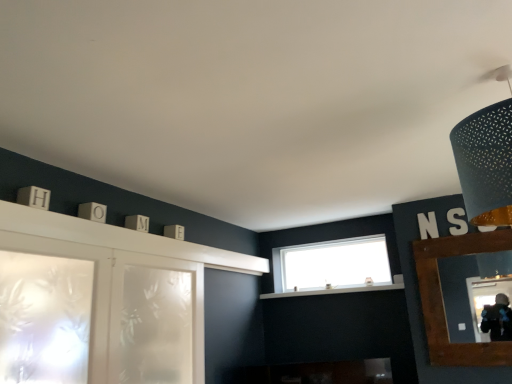
What is the approximate width of white glossy mantle at center?

white glossy mantle at center is 11.78 inches in width.

You are a GUI agent. You are given a task and a screenshot of the screen. Output one action in this format:
    pyautogui.click(x=<x>, y=<y>)
    Task: Click on the white glossy mantle at center
    This screenshot has height=384, width=512.
    Given the screenshot: What is the action you would take?
    pyautogui.click(x=333, y=291)

Image resolution: width=512 pixels, height=384 pixels. I want to click on frosted glass screen door at lower left, so click(156, 320).

Which is behind, point (157, 267) or point (422, 303)?

Positioned behind is point (422, 303).

Considering the sizes of objects frosted glass screen door at lower left and brown wooden mirror at right in the image provided, who is smaller, frosted glass screen door at lower left or brown wooden mirror at right?

With smaller size is brown wooden mirror at right.

How different are the orientations of frosted glass screen door at lower left and brown wooden mirror at right in degrees?

The angular difference between frosted glass screen door at lower left and brown wooden mirror at right is 90.5 degrees.

Is brown wooden mirror at right at the back of frosted glass screen door at lower left?

No, brown wooden mirror at right is not at the back of frosted glass screen door at lower left.

Can you confirm if frosted glass screen door at lower left is positioned to the right of white glossy mantle at center?

No.

Is frosted glass screen door at lower left looking in the opposite direction of white glossy mantle at center?

No, white glossy mantle at center is not at the back of frosted glass screen door at lower left.

Is point (196, 287) in front of point (305, 291)?

Yes, point (196, 287) is closer to viewer.

Would you say clear glass window at center is inside or outside white glossy mantle at center?

clear glass window at center is not inside white glossy mantle at center, it's outside.

Between clear glass window at center and white glossy mantle at center, which one appears on the left side from the viewer's perspective?

white glossy mantle at center.

Is clear glass window at center wider than white glossy mantle at center?

In fact, clear glass window at center might be narrower than white glossy mantle at center.

The width and height of the screenshot is (512, 384). I want to click on window above the white glossy mantle at center (from the image's perspective), so click(x=331, y=266).

What's the angular difference between brown wooden mirror at right and frosted glass screen door at lower left's facing directions?

90.5 degrees.

Is brown wooden mirror at right inside the boundaries of frosted glass screen door at lower left, or outside?

brown wooden mirror at right is outside frosted glass screen door at lower left.

Image resolution: width=512 pixels, height=384 pixels. I want to click on cabinetry behind the frosted glass screen door at lower left, so click(x=439, y=284).

Is brown wooden mirror at right bigger than frosted glass screen door at lower left?

Actually, brown wooden mirror at right might be smaller than frosted glass screen door at lower left.

From a real-world perspective, which object rests below the other?

frosted glass screen door at lower left, from a real-world perspective.

Can you confirm if matte black lampshade at upper right is positioned to the right of frosted glass screen door at lower left?

Indeed, matte black lampshade at upper right is positioned on the right side of frosted glass screen door at lower left.

Is matte black lampshade at upper right aimed at frosted glass screen door at lower left?

No.

Would you say frosted glass screen door at lower left is part of matte black lampshade at upper right's contents?

Actually, frosted glass screen door at lower left is outside matte black lampshade at upper right.

Which is farther from the camera, (x=289, y=266) or (x=450, y=344)?

Positioned behind is point (x=289, y=266).

Based on their sizes in the image, would you say clear glass window at center is bigger or smaller than brown wooden mirror at right?

clear glass window at center is bigger than brown wooden mirror at right.

Measure the distance from clear glass window at center to brown wooden mirror at right.

A distance of 30.18 inches exists between clear glass window at center and brown wooden mirror at right.

Is clear glass window at center oriented away from brown wooden mirror at right?

No, brown wooden mirror at right is not at the back of clear glass window at center.

Does white glossy mantle at center have a smaller size compared to brown wooden mirror at right?

No, white glossy mantle at center is not smaller than brown wooden mirror at right.

From the image's perspective, is white glossy mantle at center beneath brown wooden mirror at right?

Correct, white glossy mantle at center appears lower than brown wooden mirror at right in the image.

How many degrees apart are the facing directions of white glossy mantle at center and brown wooden mirror at right?

They differ by 0.136 degrees in their facing directions.

Is white glossy mantle at center to the right of brown wooden mirror at right from the viewer's perspective?

In fact, white glossy mantle at center is to the left of brown wooden mirror at right.

Locate an element on the screen. The width and height of the screenshot is (512, 384). cabinetry above the frosted glass screen door at lower left (from a real-world perspective) is located at coordinates (439, 284).

Find the location of a particular element. Image resolution: width=512 pixels, height=384 pixels. screen door that appears in front of the white glossy mantle at center is located at coordinates (156, 320).

Based on their spatial positions, is white glossy mantle at center or matte black lampshade at upper right closer to frosted glass screen door at lower left?

The object closer to frosted glass screen door at lower left is white glossy mantle at center.

From the image, which object appears to be farther from matte black lampshade at upper right, clear glass window at center or white glossy mantle at center?

Based on the image, clear glass window at center appears to be further to matte black lampshade at upper right.

Considering their positions, is white glossy mantle at center positioned further to frosted glass screen door at lower left than brown wooden mirror at right?

brown wooden mirror at right is further to frosted glass screen door at lower left.

From the image, which object appears to be nearer to white glossy mantle at center, matte black lampshade at upper right or clear glass window at center?

clear glass window at center is closer to white glossy mantle at center.

From the image, which object appears to be nearer to frosted glass screen door at lower left, brown wooden mirror at right or matte black lampshade at upper right?

Among the two, brown wooden mirror at right is located nearer to frosted glass screen door at lower left.

Estimate the real-world distances between objects in this image. Which object is further from clear glass window at center, white glossy mantle at center or matte black lampshade at upper right?

matte black lampshade at upper right lies further to clear glass window at center than the other object.

When comparing their distances from white glossy mantle at center, does frosted glass screen door at lower left or matte black lampshade at upper right seem closer?

Based on the image, frosted glass screen door at lower left appears to be nearer to white glossy mantle at center.

Considering their positions, is clear glass window at center positioned closer to white glossy mantle at center than frosted glass screen door at lower left?

Among the two, clear glass window at center is located nearer to white glossy mantle at center.

I want to click on screen door between matte black lampshade at upper right and white glossy mantle at center along the z-axis, so click(x=156, y=320).

I want to click on cabinetry between matte black lampshade at upper right and white glossy mantle at center in the front-back direction, so click(x=439, y=284).

Image resolution: width=512 pixels, height=384 pixels. What are the coordinates of `screen door between matte black lampshade at upper right and clear glass window at center along the z-axis` in the screenshot? It's located at (156, 320).

At what (x,y) coordinates should I click in order to perform the action: click on mantle between frosted glass screen door at lower left and brown wooden mirror at right from left to right. Please return your answer as a coordinate pair (x, y). This screenshot has width=512, height=384. Looking at the image, I should click on (333, 291).